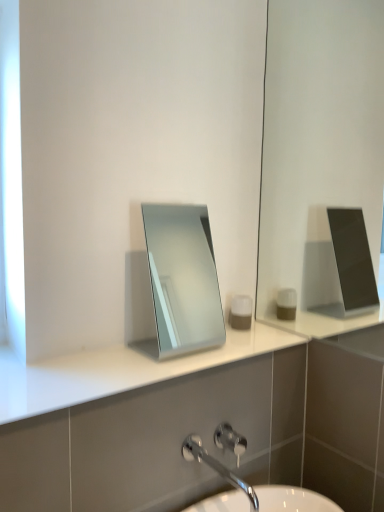
Describe the element at coordinates (117, 371) in the screenshot. I see `white glossy counter top at center` at that location.

At what (x,y) coordinates should I click in order to perform the action: click on matte gray container at center. Please return your answer as a coordinate pair (x, y). The width and height of the screenshot is (384, 512). Looking at the image, I should click on (241, 312).

Is white glossy counter top at center to the right of matte gray container at center from the viewer's perspective?

Incorrect, white glossy counter top at center is not on the right side of matte gray container at center.

Considering the sizes of objects white glossy counter top at center and matte gray container at center in the image provided, who is thinner, white glossy counter top at center or matte gray container at center?

matte gray container at center.

From the image's perspective, would you say white glossy counter top at center is positioned over matte gray container at center?

No.

Is white glossy counter top at center turned away from matte gray container at center?

No, matte gray container at center is not at the back of white glossy counter top at center.

Is chrome metallic faucet at lower center taller than matte gray container at center?

No, chrome metallic faucet at lower center is not taller than matte gray container at center.

Consider the image. Is chrome metallic faucet at lower center surrounding matte gray container at center?

No, matte gray container at center is not surrounded by chrome metallic faucet at lower center.

Locate an element on the screen. Image resolution: width=384 pixels, height=512 pixels. tap that appears below the matte gray container at center (from the image's perspective) is located at coordinates (217, 467).

Is the position of chrome metallic faucet at lower center less distant than that of matte gray container at center?

Yes, the depth of chrome metallic faucet at lower center is less than that of matte gray container at center.

What's the angular difference between silver metallic mirror at center and chrome metallic faucet at lower center's facing directions?

The angle between the facing direction of silver metallic mirror at center and the facing direction of chrome metallic faucet at lower center is 0.274 degrees.

Is silver metallic mirror at center touching chrome metallic faucet at lower center?

No, silver metallic mirror at center is not touching chrome metallic faucet at lower center.

Would you say silver metallic mirror at center is inside or outside chrome metallic faucet at lower center?

silver metallic mirror at center is outside chrome metallic faucet at lower center.

Which object is wider, silver metallic mirror at center or chrome metallic faucet at lower center?

With larger width is chrome metallic faucet at lower center.

Is white glossy counter top at center taller than silver metallic mirror at center?

No.

How much distance is there between white glossy counter top at center and silver metallic mirror at center?

white glossy counter top at center and silver metallic mirror at center are 1.94 meters apart.

Is white glossy counter top at center looking in the opposite direction of silver metallic mirror at center?

No, white glossy counter top at center's orientation is not away from silver metallic mirror at center.

From a real-world perspective, which is physically above, white glossy counter top at center or silver metallic mirror at center?

silver metallic mirror at center is physically above.

From a real-world perspective, is matte gray container at center beneath white glossy counter top at center?

No, from a real-world perspective, matte gray container at center is not below white glossy counter top at center.

Image resolution: width=384 pixels, height=512 pixels. I want to click on counter top on the left of matte gray container at center, so click(x=117, y=371).

Can you confirm if matte gray container at center is positioned to the right of white glossy counter top at center?

Yes.

Would you say matte gray container at center is outside white glossy counter top at center?

matte gray container at center is positioned outside white glossy counter top at center.

Can you tell me how much silver metallic mirror at center and brushed metal shower at lower center differ in facing direction?

The angular difference between silver metallic mirror at center and brushed metal shower at lower center is 0.275 degrees.

Who is smaller, silver metallic mirror at center or brushed metal shower at lower center?

brushed metal shower at lower center.

Is silver metallic mirror at center situated inside brushed metal shower at lower center or outside?

silver metallic mirror at center lies outside brushed metal shower at lower center.

In the image, is silver metallic mirror at center positioned in front of or behind brushed metal shower at lower center?

Visually, silver metallic mirror at center is located in front of brushed metal shower at lower center.

Does point (238, 323) appear closer or farther from the camera than point (246, 441)?

Clearly, point (238, 323) is more distant from the camera than point (246, 441).

Is matte gray container at center next to chrome metallic faucet at lower center?

No, matte gray container at center is not making contact with chrome metallic faucet at lower center.

Identify the location of toiletry above the chrome metallic faucet at lower center (from the image's perspective). Image resolution: width=384 pixels, height=512 pixels. (241, 312).

The width and height of the screenshot is (384, 512). Find the location of `counter top located on the left of matte gray container at center`. counter top located on the left of matte gray container at center is located at coordinates click(117, 371).

You are a GUI agent. You are given a task and a screenshot of the screen. Output one action in this format:
    pyautogui.click(x=<x>, y=<y>)
    Task: Click on the toiletry on the right of chrome metallic faucet at lower center
    
    Given the screenshot: What is the action you would take?
    pyautogui.click(x=241, y=312)

Which object lies further to the anchor point white glossy counter top at center, chrome metallic faucet at lower center or matte gray container at center?

The object further to white glossy counter top at center is matte gray container at center.

From the picture: Estimate the real-world distances between objects in this image. Which object is further from white glossy counter top at center, matte gray container at center or silver metallic mirror at center?

silver metallic mirror at center is further to white glossy counter top at center.

Considering their positions, is white glossy counter top at center positioned closer to silver metallic mirror at center than chrome metallic faucet at lower center?

The object closer to silver metallic mirror at center is white glossy counter top at center.

Which object lies further to the anchor point brushed metal shower at lower center, white glossy counter top at center or silver metallic mirror at center?

The object further to brushed metal shower at lower center is silver metallic mirror at center.

Looking at this image, from the image, which object appears to be nearer to silver metallic mirror at center, matte gray container at center or white glossy counter top at center?

matte gray container at center.

When comparing their distances from silver metallic mirror at center, does brushed metal shower at lower center or chrome metallic faucet at lower center seem further?

Among the two, brushed metal shower at lower center is located further to silver metallic mirror at center.

Based on their spatial positions, is white glossy counter top at center or silver metallic mirror at center further from chrome metallic faucet at lower center?

silver metallic mirror at center lies further to chrome metallic faucet at lower center than the other object.

Estimate the real-world distances between objects in this image. Which object is closer to brushed metal shower at lower center, chrome metallic faucet at lower center or matte gray container at center?

→ chrome metallic faucet at lower center.

Where is `mirror between chrome metallic faucet at lower center and matte gray container at center in the front-back direction`? The image size is (384, 512). mirror between chrome metallic faucet at lower center and matte gray container at center in the front-back direction is located at coordinates (183, 278).

Locate an element on the screen. toiletry between silver metallic mirror at center and brushed metal shower at lower center in the up-down direction is located at coordinates (241, 312).

At what (x,y) coordinates should I click in order to perform the action: click on mirror positioned between white glossy counter top at center and matte gray container at center from near to far. Please return your answer as a coordinate pair (x, y). Looking at the image, I should click on (183, 278).

The image size is (384, 512). What are the coordinates of `tap positioned between white glossy counter top at center and brushed metal shower at lower center from near to far` in the screenshot? It's located at (217, 467).